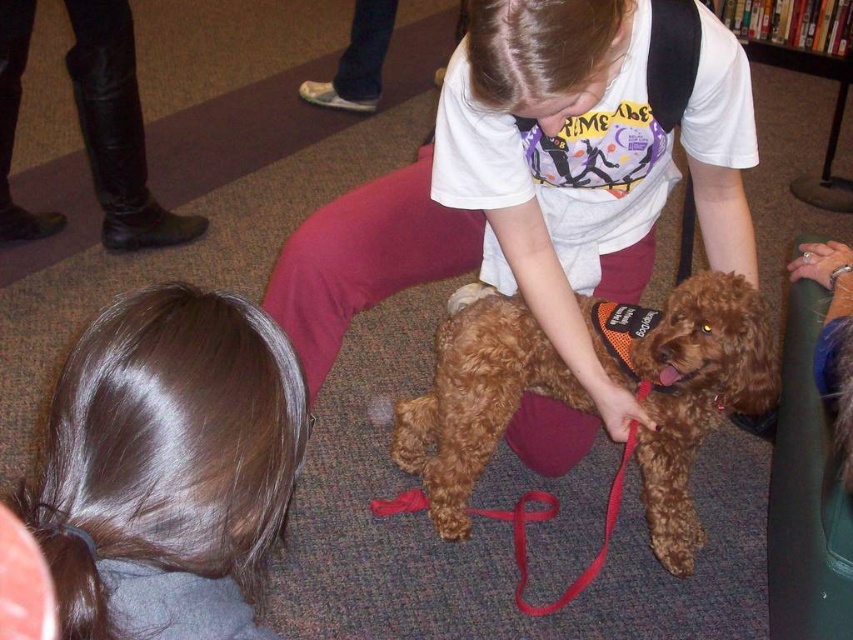
You are a photographer trying to capture a closeup of the brown shiny hair at lower left and the brown fuzzy dog at center. Which object would require a wider lens to capture its details?

The brown shiny hair at lower left is thinner than the brown fuzzy dog at center, so the brown fuzzy dog at center requires a wider lens to capture its details because it is larger in size.

You are a visitor in the library and see the brown shiny hair at lower left and the brown fuzzy dog at center. Which object is positioned more to the left?

The brown shiny hair at lower left is positioned more to the left than the brown fuzzy dog at center.